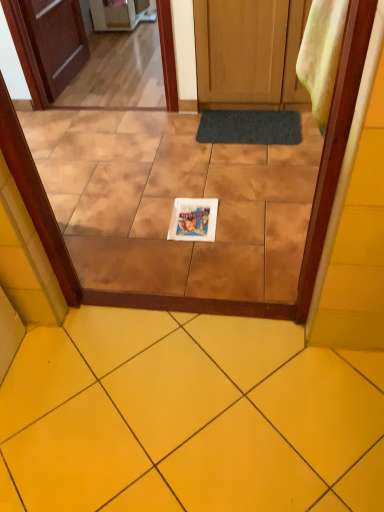
Image resolution: width=384 pixels, height=512 pixels. What are the coordinates of `free space to the left of white glossy magazine at center` in the screenshot? It's located at (142, 230).